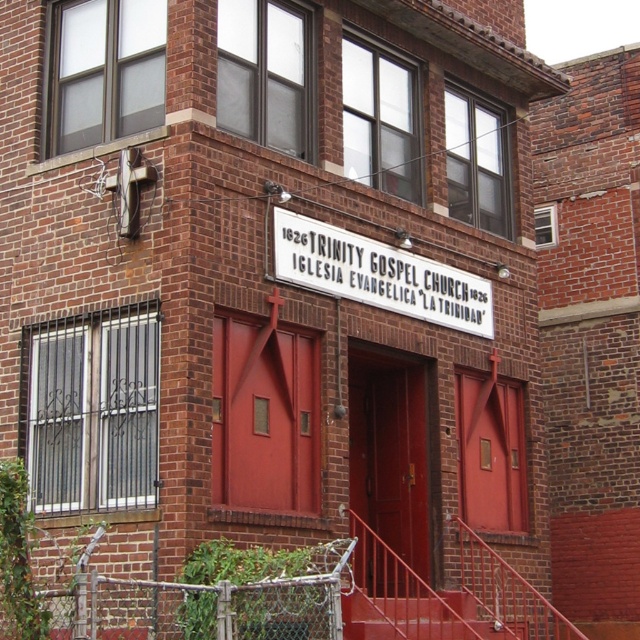
Question: Which object is farther from the camera taking this photo?

Choices:
 (A) white plastic sign at center
 (B) chain-link fence at lower left

Answer: (A)

Question: Can you confirm if chain-link fence at lower left is positioned to the left of white plastic sign at center?

Choices:
 (A) yes
 (B) no

Answer: (A)

Question: Is chain-link fence at lower left positioned behind white plastic sign at center?

Choices:
 (A) yes
 (B) no

Answer: (B)

Question: Observing the image, what is the correct spatial positioning of white plastic sign at center in reference to metallic red staircase at center?

Choices:
 (A) left
 (B) right

Answer: (A)

Question: Estimate the real-world distances between objects in this image. Which object is closer to the white plastic sign at center?

Choices:
 (A) chain-link fence at lower left
 (B) metallic red staircase at center

Answer: (B)

Question: Which object is closer to the camera taking this photo?

Choices:
 (A) metallic red staircase at center
 (B) chain-link fence at lower left

Answer: (B)